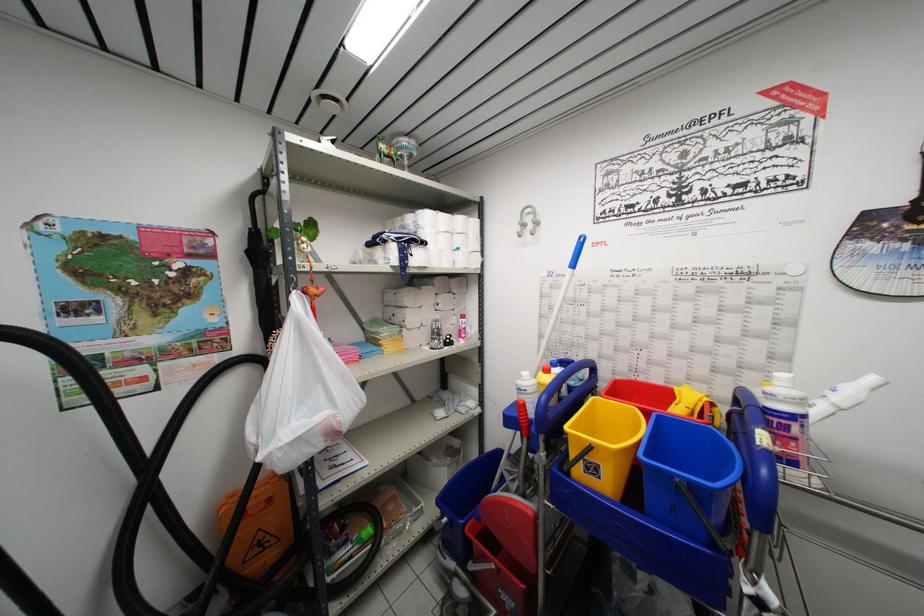
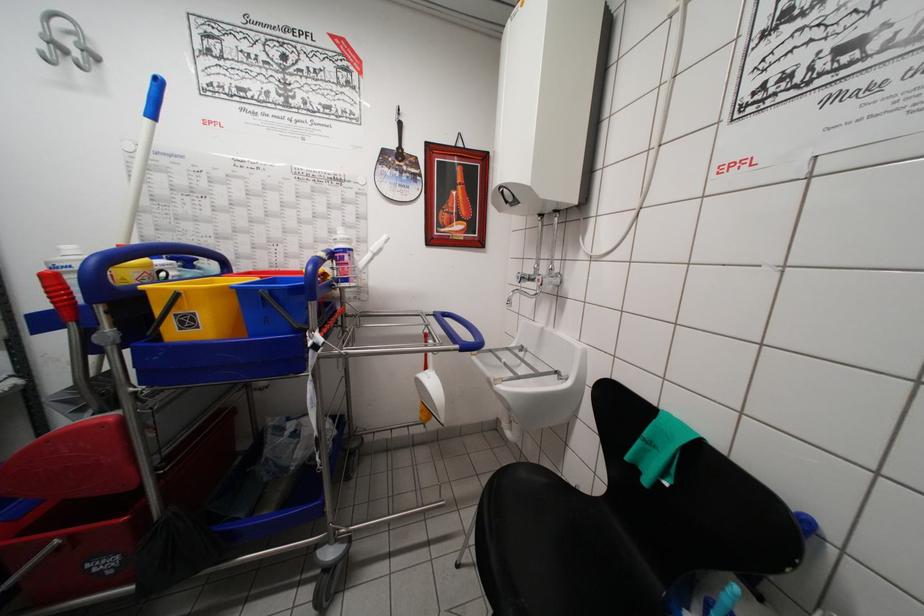
Locate, in the second image, the point that corresponds to pixel 574 275 in the first image.

(151, 124)